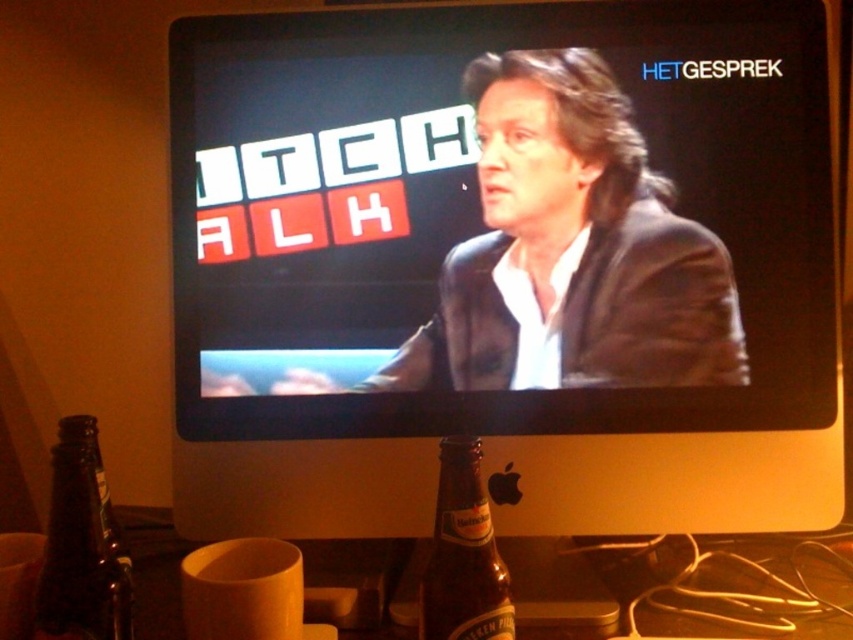
Is point (517, 269) farther from viewer compared to point (440, 508)?

That is True.

Can you confirm if black glossy computer monitor at center is smaller than brown glass bottle at lower center?

Actually, black glossy computer monitor at center might be larger than brown glass bottle at lower center.

Which is in front, point (239, 288) or point (453, 476)?

Point (453, 476) is in front.

You are a GUI agent. You are given a task and a screenshot of the screen. Output one action in this format:
    pyautogui.click(x=<x>, y=<y>)
    Task: Click on the black glossy computer monitor at center
    Image resolution: width=853 pixels, height=640 pixels.
    Given the screenshot: What is the action you would take?
    pyautogui.click(x=503, y=272)

Can you confirm if black glossy computer monitor at center is positioned to the right of brown glass bottle at lower left?

Yes, black glossy computer monitor at center is to the right of brown glass bottle at lower left.

Who is positioned more to the left, black glossy computer monitor at center or brown glass bottle at lower left?

brown glass bottle at lower left

Is point (236, 161) farther from camera compared to point (125, 554)?

Yes.

Where is `black glossy computer monitor at center`? The width and height of the screenshot is (853, 640). black glossy computer monitor at center is located at coordinates (503, 272).

Is brown glass bottle at lower left above brown glass bottle at lower center?

Incorrect, brown glass bottle at lower left is not positioned above brown glass bottle at lower center.

Who is shorter, brown glass bottle at lower left or brown glass bottle at lower center?

brown glass bottle at lower center is shorter.

Where is `brown glass bottle at lower left`? This screenshot has height=640, width=853. brown glass bottle at lower left is located at coordinates (82, 547).